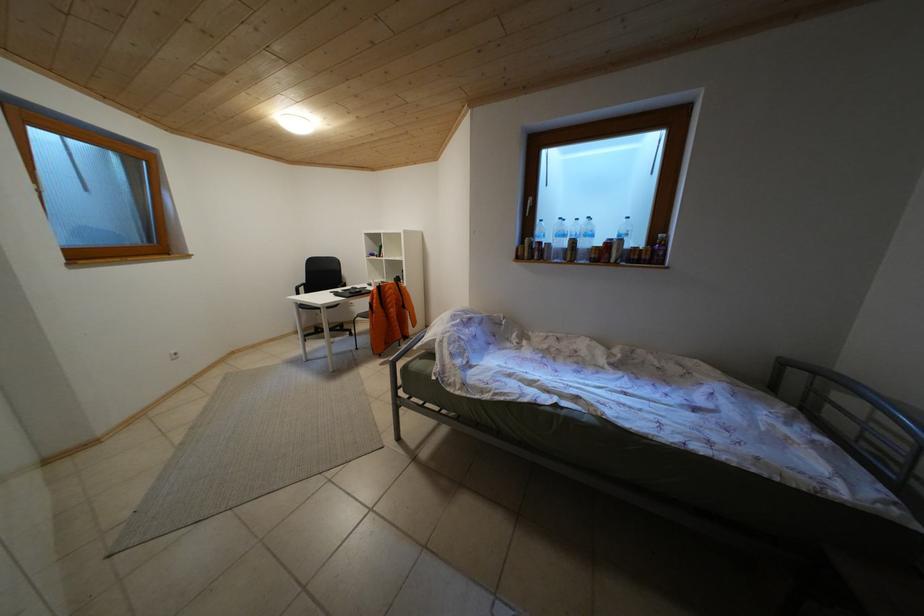
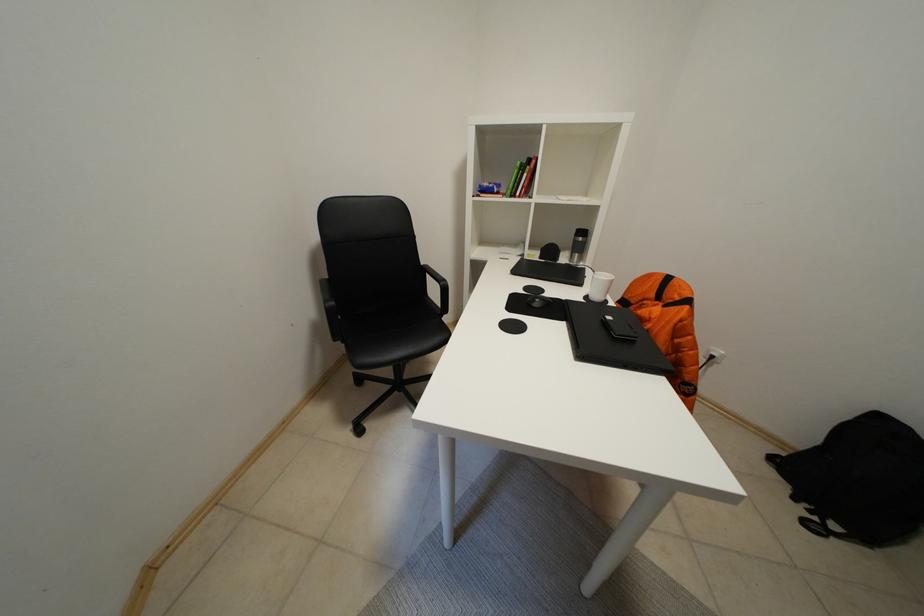
The images are taken continuously from a first-person perspective. In which direction are you moving?

The cameraman moved toward left, forward.